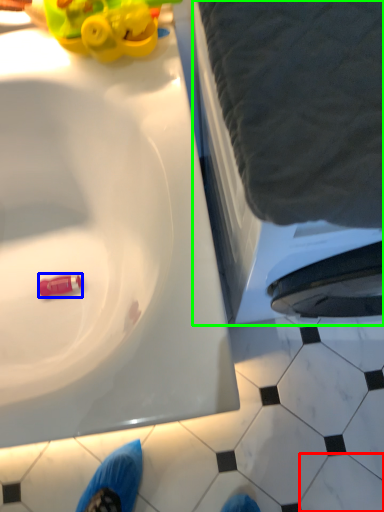
Question: Which object is the farthest from tile (highlighted by a red box)? Choose among these: toy (highlighted by a blue box) or bath (highlighted by a green box).

Choices:
 (A) toy
 (B) bath

Answer: (A)